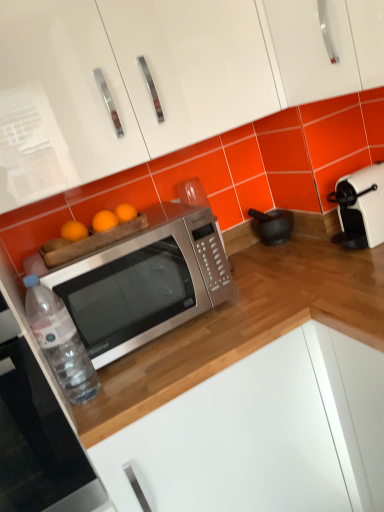
Question: From a real-world perspective, is white plastic toaster at right physically below clear plastic bottle at lower left?

Choices:
 (A) no
 (B) yes

Answer: (B)

Question: Is white plastic toaster at right positioned far away from clear plastic bottle at lower left?

Choices:
 (A) no
 (B) yes

Answer: (A)

Question: Does white plastic toaster at right have a greater height compared to clear plastic bottle at lower left?

Choices:
 (A) yes
 (B) no

Answer: (B)

Question: Does white plastic toaster at right come in front of clear plastic bottle at lower left?

Choices:
 (A) no
 (B) yes

Answer: (A)

Question: From a real-world perspective, does white plastic toaster at right stand above clear plastic bottle at lower left?

Choices:
 (A) no
 (B) yes

Answer: (A)

Question: Considering the positions of satin silver microwave at center and black matte mortar at lower center in the image, is satin silver microwave at center wider or thinner than black matte mortar at lower center?

Choices:
 (A) thin
 (B) wide

Answer: (B)

Question: Does point (97, 343) appear closer or farther from the camera than point (276, 230)?

Choices:
 (A) closer
 (B) farther

Answer: (A)

Question: Considering the positions of satin silver microwave at center and black matte mortar at lower center in the image, is satin silver microwave at center taller or shorter than black matte mortar at lower center?

Choices:
 (A) tall
 (B) short

Answer: (A)

Question: From the image's perspective, is satin silver microwave at center positioned above or below black matte mortar at lower center?

Choices:
 (A) above
 (B) below

Answer: (B)

Question: In terms of height, does clear plastic bottle at lower left look taller or shorter compared to white glossy cabinet at lower center, the first cabinetry ordered from the bottom?

Choices:
 (A) short
 (B) tall

Answer: (A)

Question: From the image's perspective, relative to white glossy cabinet at lower center, arranged as the 2th cabinetry when viewed from the top, is clear plastic bottle at lower left above or below?

Choices:
 (A) above
 (B) below

Answer: (A)

Question: Is clear plastic bottle at lower left to the left or to the right of white glossy cabinet at lower center, arranged as the 2th cabinetry when viewed from the top, in the image?

Choices:
 (A) right
 (B) left

Answer: (B)

Question: Is clear plastic bottle at lower left inside the boundaries of white glossy cabinet at lower center, arranged as the 2th cabinetry when viewed from the top, or outside?

Choices:
 (A) inside
 (B) outside

Answer: (B)

Question: Is point (77, 389) positioned closer to the camera than point (8, 306)?

Choices:
 (A) closer
 (B) farther

Answer: (B)

Question: Considering the positions of clear plastic bottle at lower left and brushed metal microwave at lower left in the image, is clear plastic bottle at lower left wider or thinner than brushed metal microwave at lower left?

Choices:
 (A) wide
 (B) thin

Answer: (B)